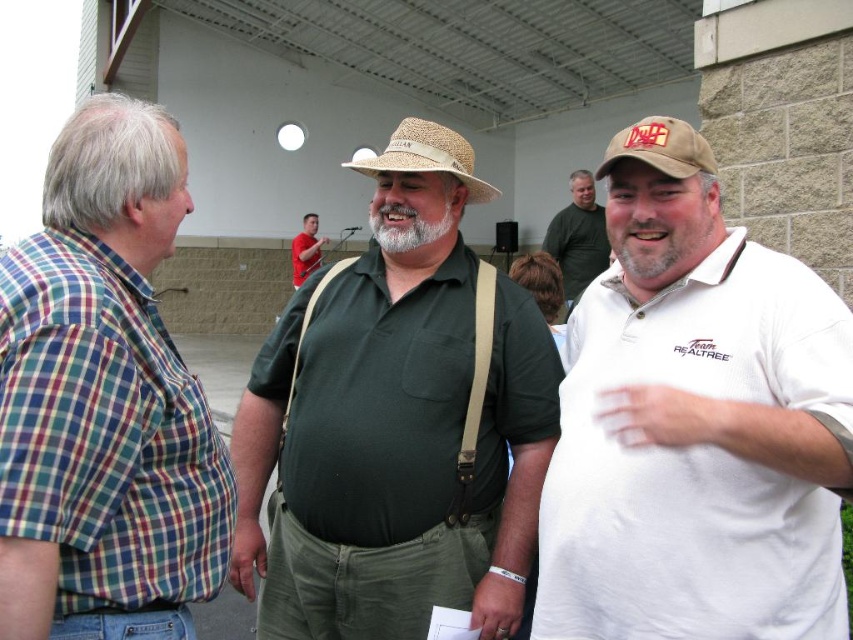
Question: Which object is farther from the camera taking this photo?

Choices:
 (A) white cotton polo shirt at right
 (B) gray/bearded face at center

Answer: (B)

Question: Which point is closer to the camera taking this photo?

Choices:
 (A) (119, 348)
 (B) (404, 237)
 (C) (677, 164)
 (D) (558, 259)

Answer: (A)

Question: Can you confirm if white cotton shirt at upper right is positioned to the left of graywoollybeard at center?

Choices:
 (A) yes
 (B) no

Answer: (B)

Question: Which is nearer to the graywoollybeard at center?

Choices:
 (A) white cotton polo shirt at right
 (B) plaid shirt at left
 (C) gray/bearded face at center
 (D) straw hat at center

Answer: (C)

Question: Is white cotton polo shirt at right bigger than white cotton shirt at upper right?

Choices:
 (A) yes
 (B) no

Answer: (B)

Question: Does gray/bearded face at center appear over red cotton shirt at center?

Choices:
 (A) yes
 (B) no

Answer: (B)